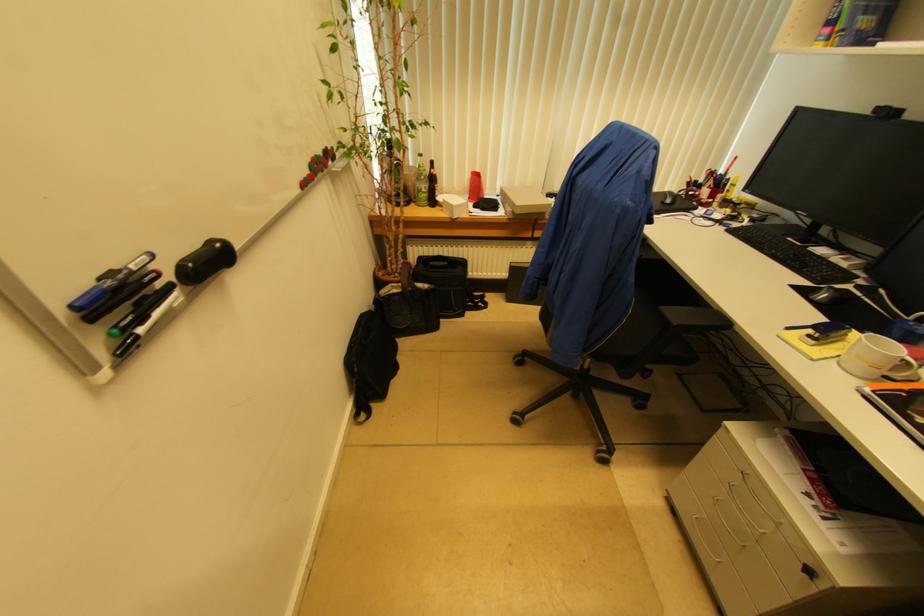
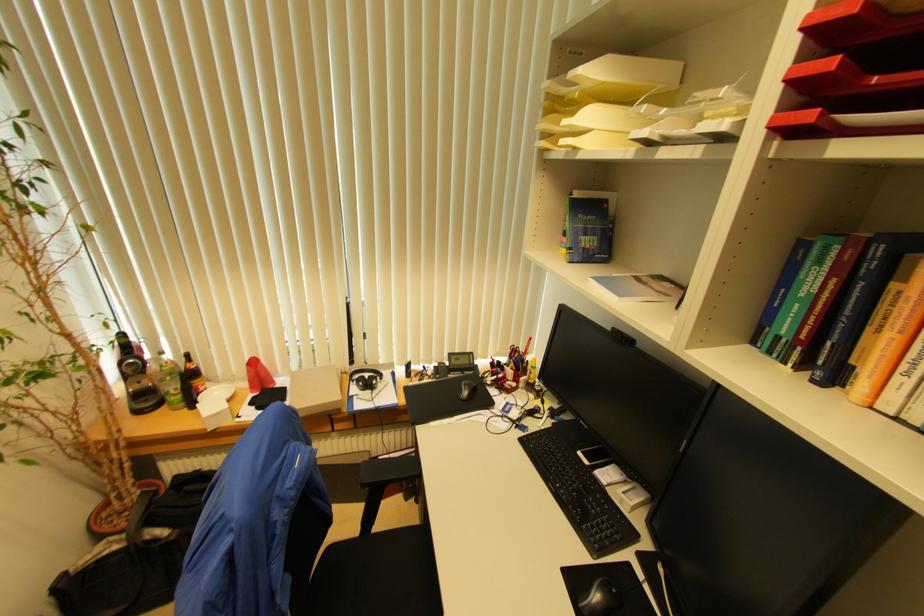
The point at (670, 203) is marked in the first image. Where is the corresponding point in the second image?

(467, 395)